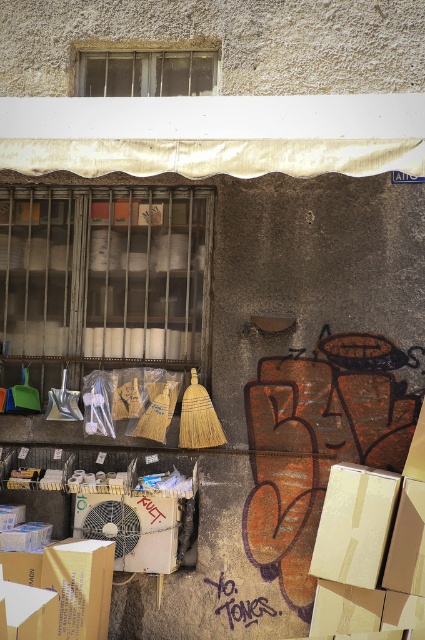
Question: Can you confirm if white cardboard box at center is positioned to the right of brown cardboard box at lower left?

Choices:
 (A) no
 (B) yes

Answer: (B)

Question: Which of the following is the closest to the observer?

Choices:
 (A) (320, 544)
 (B) (104, 628)

Answer: (A)

Question: Is white cardboard box at center positioned before brown cardboard box at lower left?

Choices:
 (A) yes
 (B) no

Answer: (A)

Question: Can you confirm if white cardboard box at center is positioned below brown cardboard box at lower left?

Choices:
 (A) yes
 (B) no

Answer: (B)